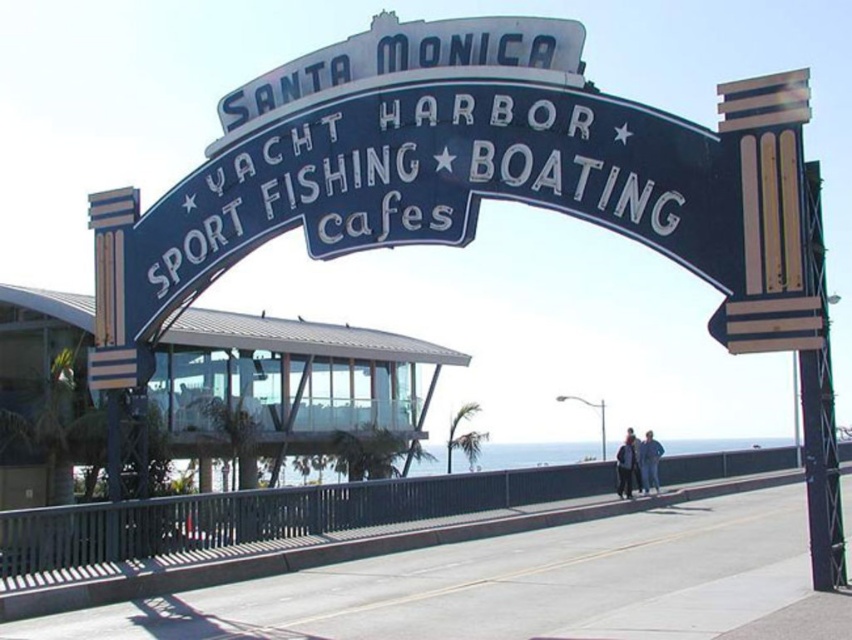
Is dark blue jacket at center to the right of blue denim jacket at lower center from the viewer's perspective?

In fact, dark blue jacket at center is to the left of blue denim jacket at lower center.

Does dark blue jacket at center come behind blue denim jacket at lower center?

No, it is not.

Identify the location of dark blue jacket at center. (625, 467).

Locate an element on the screen. dark blue jacket at center is located at coordinates (625, 467).

Between point (660, 451) and point (632, 476), which one is positioned in front?

Positioned in front is point (632, 476).

Does light blue denim jacket at lower right appear under dark blue jacket at center?

Yes.

What are the coordinates of `light blue denim jacket at lower right` in the screenshot? It's located at (649, 461).

At what (x,y) coordinates should I click in order to perform the action: click on light blue denim jacket at lower right. Please return your answer as a coordinate pair (x, y). This screenshot has height=640, width=852. Looking at the image, I should click on (649, 461).

Can you confirm if light blue denim jacket at lower right is taller than blue denim jacket at lower center?

Yes, light blue denim jacket at lower right is taller than blue denim jacket at lower center.

Is light blue denim jacket at lower right positioned behind blue denim jacket at lower center?

That is True.

The image size is (852, 640). In order to click on light blue denim jacket at lower right in this screenshot , I will do `click(649, 461)`.